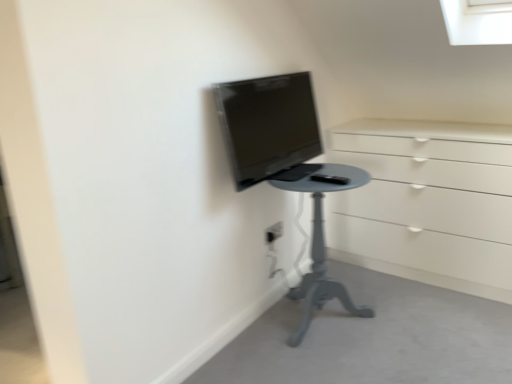
The width and height of the screenshot is (512, 384). Find the location of `vacant area located to the right-hand side of matte gray table at center`. vacant area located to the right-hand side of matte gray table at center is located at coordinates (406, 316).